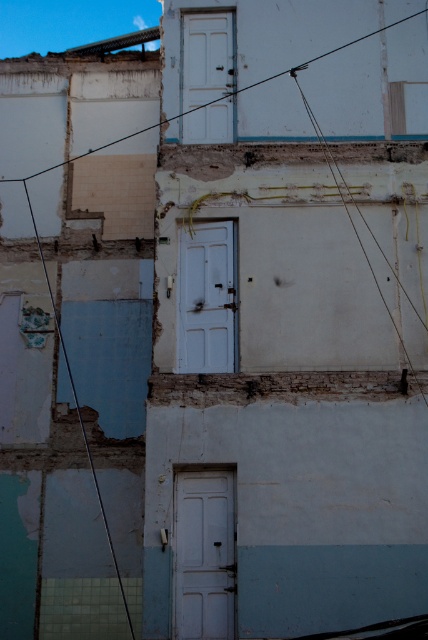
Question: Does rusty wire at left have a greater width compared to rusty wire at right?

Choices:
 (A) no
 (B) yes

Answer: (B)

Question: Considering the real-world distances, which object is closest to the rusty wire at left?

Choices:
 (A) rusty wire at right
 (B) smooth wire at upper center

Answer: (B)

Question: Which of these objects is positioned closest to the rusty wire at left?

Choices:
 (A) rusty wire at right
 (B) smooth wire at upper center

Answer: (B)

Question: Is smooth wire at upper center to the left of rusty wire at left from the viewer's perspective?

Choices:
 (A) yes
 (B) no

Answer: (B)

Question: Which point appears closest to the camera in this image?

Choices:
 (A) (389, 308)
 (B) (211, 104)

Answer: (A)

Question: Is smooth wire at upper center further to the viewer compared to rusty wire at right?

Choices:
 (A) yes
 (B) no

Answer: (A)